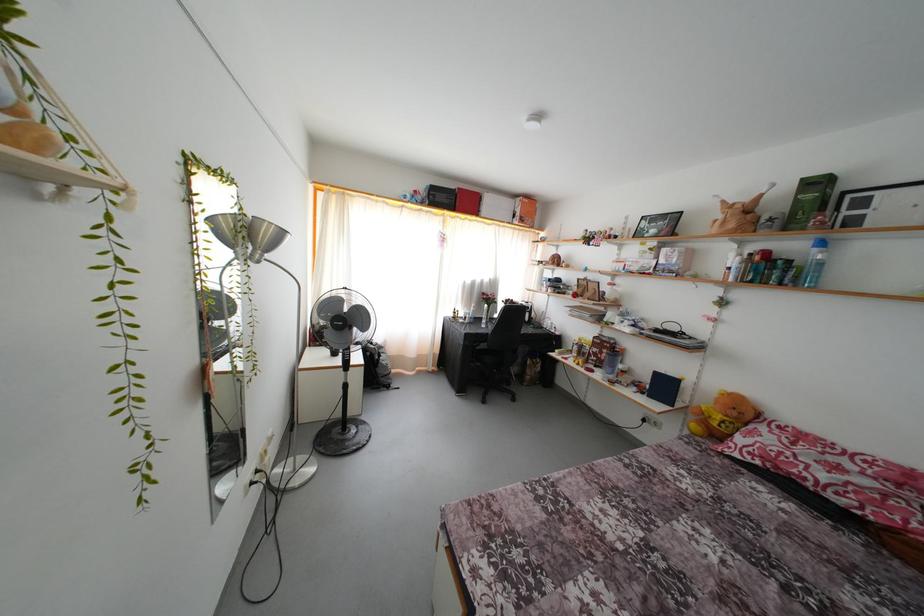
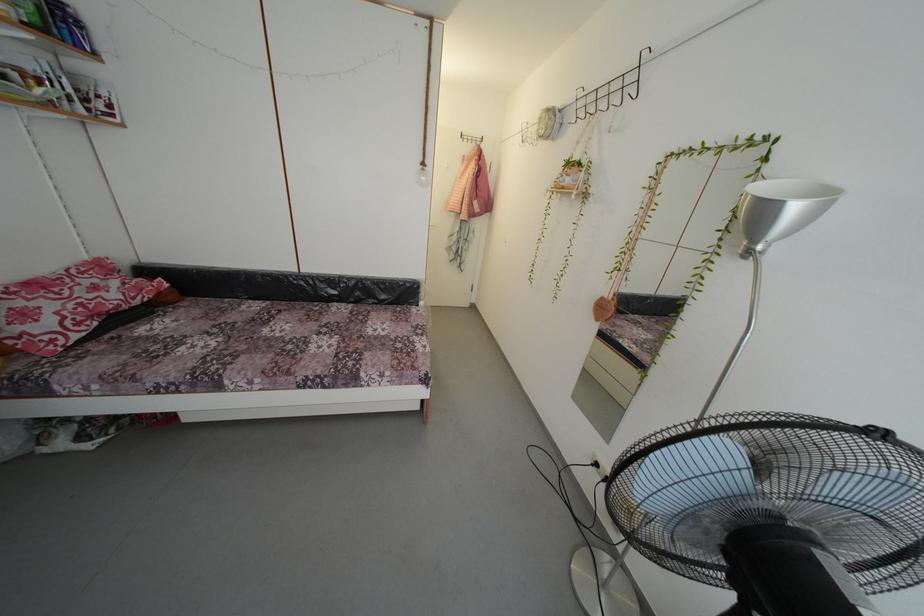
The point at (697,498) is marked in the first image. Where is the corresponding point in the second image?

(225, 345)